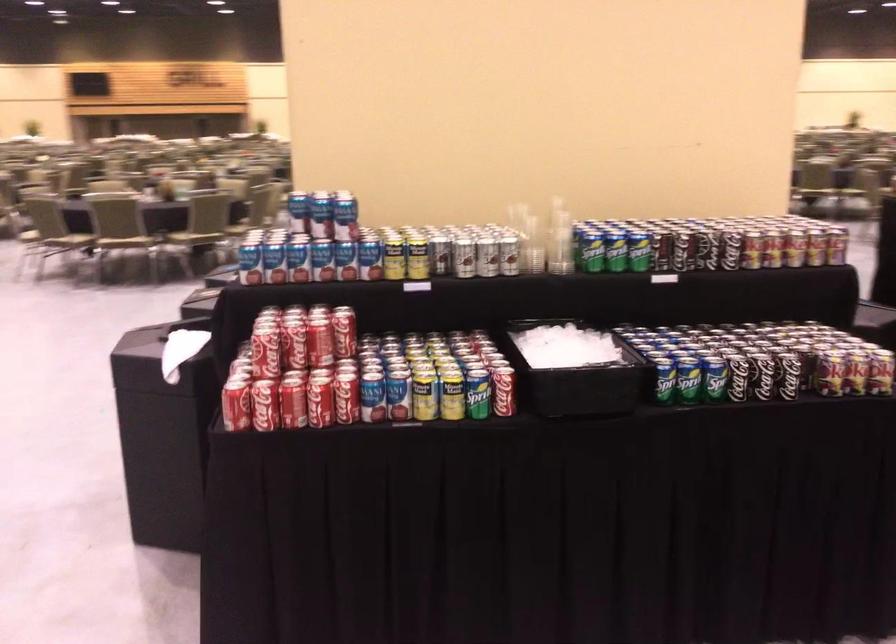
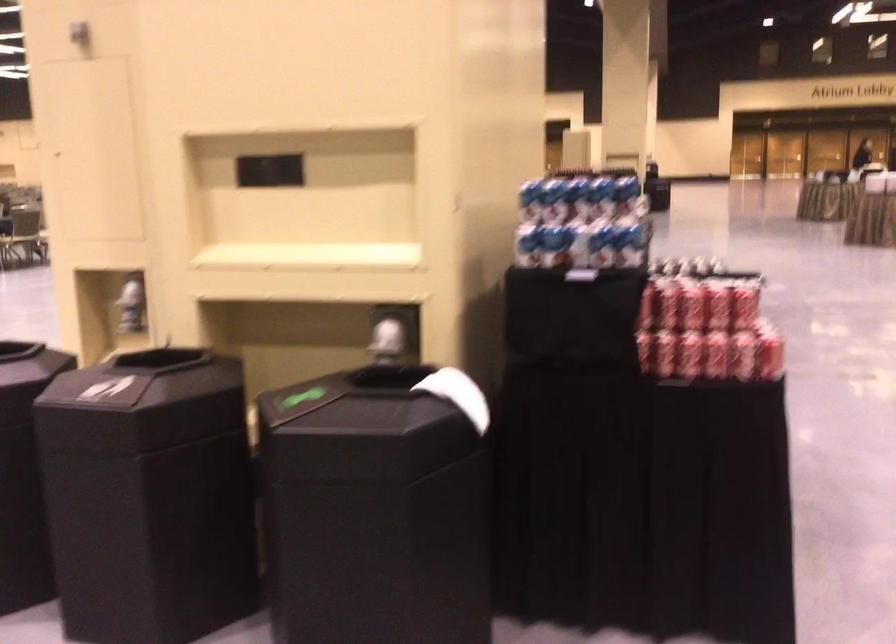
In the second image, find the point that corresponds to point 201,342 in the first image.

(458, 395)